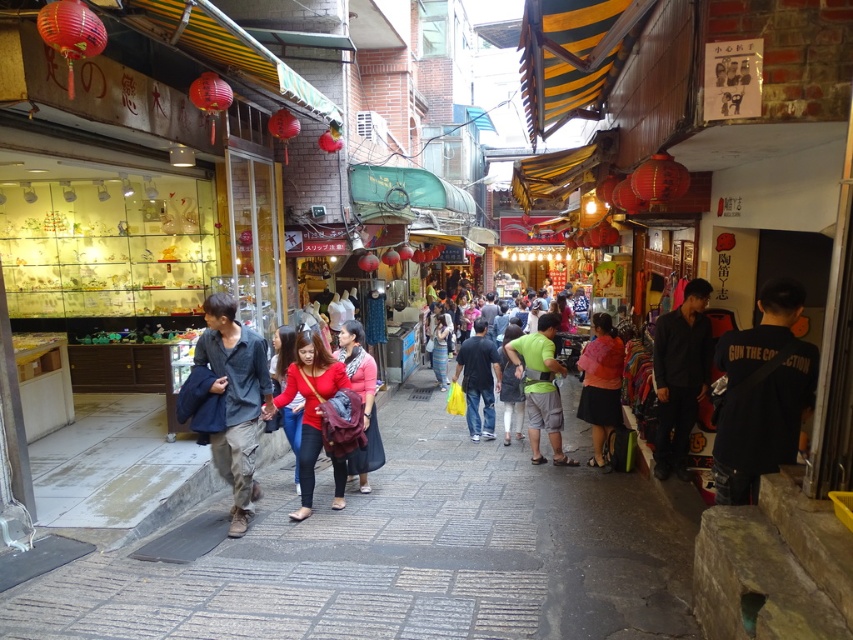
You are a customer in the market and want to buy both the denim shirt at center and the matte pink shirt at center. Which shirt is positioned higher up on the display rack?

The denim shirt at center is located above the matte pink shirt at center, so it is positioned higher up on the display rack.

Consider the image. You are a delivery person carrying a package that is 2 feet long. You need to navigate through the narrow alleyway between the denim shirt at center and the red matte jacket at center. Can the package fit through the space between them?

The distance between the denim shirt at center and the red matte jacket at center is 21.65 inches. Since the package is 2 feet long, which is 24 inches, the package cannot fit through the space between them as it is shorter than the required length.